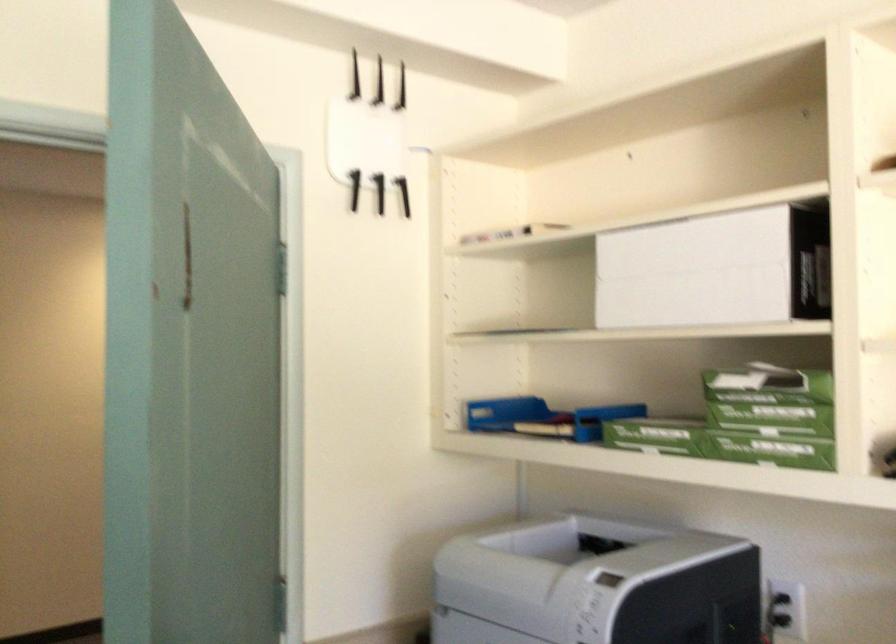
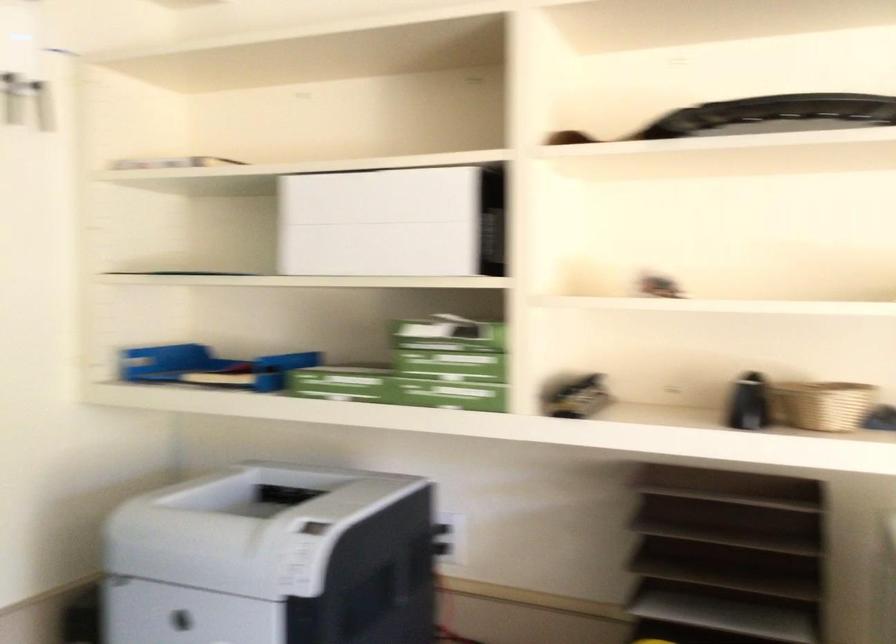
The point at (545, 421) is marked in the first image. Where is the corresponding point in the second image?

(209, 366)